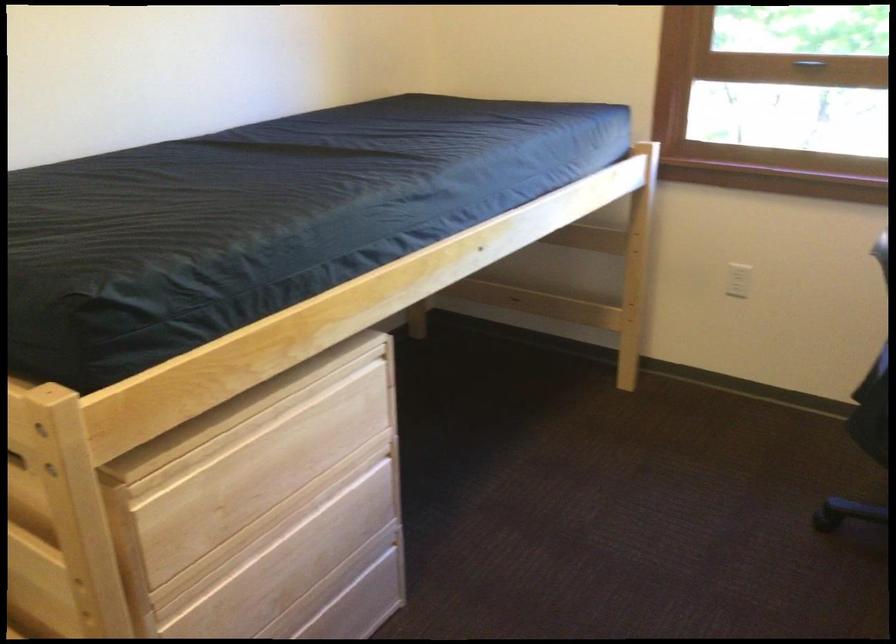
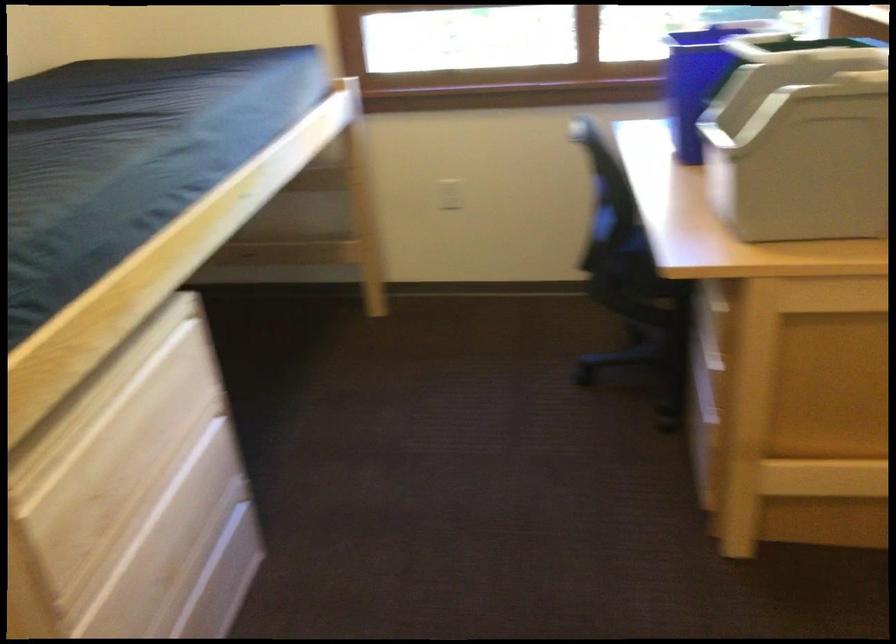
Question: The camera is either moving clockwise (left) or counter-clockwise (right) around the object. The first image is from the beginning of the video and the second image is from the end. Is the camera moving left or right when shooting the video?

Choices:
 (A) Left
 (B) Right

Answer: (A)